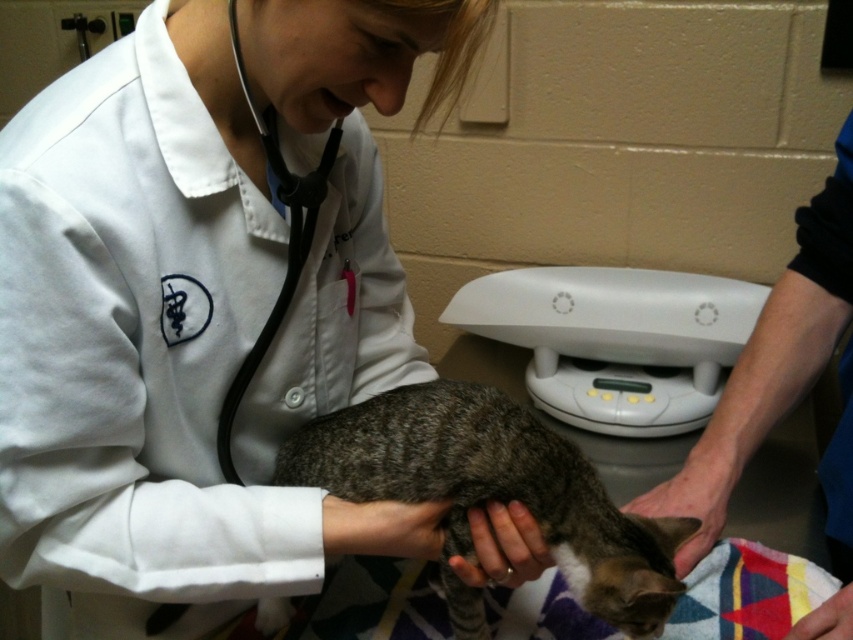
You are a veterinary assistant who needs to place a medical kit between the white smooth coat at center and the gray striped fur cat at center. The medical kit is 6 inches long. Can you fit it between them?

The distance between the white smooth coat at center and the gray striped fur cat at center is 5.66 inches. Since the medical kit is 6 inches long, it cannot fit in the space provided.

You are a veterinary assistant trying to place a gray striped fur cat at center onto a white coat at center. Can the cat fit on the white coat without overlapping the edges?

The gray striped fur cat at center might be wider than white coat at center, so there is a possibility that the cat will not fit entirely on the coat without overlapping the edges.